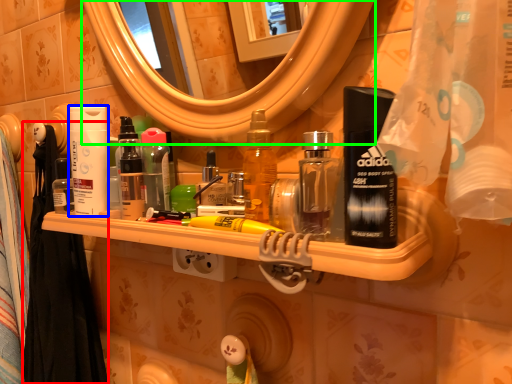
Question: Based on their relative distances, which object is nearer to shower curtain (highlighted by a red box)? Choose from cleaning product (highlighted by a blue box) and mirror (highlighted by a green box).

Choices:
 (A) cleaning product
 (B) mirror

Answer: (A)